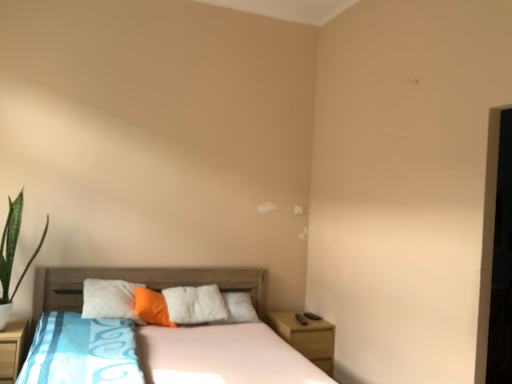
Measure the distance between point (23, 321) and camera.

2.94 meters.

What are the coordinates of `wooden bed at center` in the screenshot? It's located at pyautogui.click(x=190, y=327).

Consider the image. Is wooden nightstand at lower right, acting as the first nightstand starting from the back, oriented away from wooden bed at center?

No, wooden nightstand at lower right, acting as the first nightstand starting from the back,'s orientation is not away from wooden bed at center.

Does wooden nightstand at lower right, acting as the first nightstand starting from the back, have a larger size compared to wooden bed at center?

No.

Does wooden nightstand at lower right, the second nightstand positioned from the front, appear on the right side of wooden bed at center?

Correct, you'll find wooden nightstand at lower right, the second nightstand positioned from the front, to the right of wooden bed at center.

Does wooden nightstand at lower right, acting as the first nightstand starting from the back, have a lesser width compared to wooden bed at center?

Yes.

Does wooden nightstand at lower left, the 1th nightstand viewed from the front, come in front of green leafy plant at left?

No.

From the image's perspective, which object appears higher, wooden nightstand at lower left, the 2th nightstand in the back-to-front sequence, or green leafy plant at left?

From the image's view, green leafy plant at left is above.

Consider the image. Which is behind, wooden bed at center or wooden nightstand at lower left, the 1th nightstand viewed from the front?

wooden nightstand at lower left, the 1th nightstand viewed from the front, is behind.

Is point (188, 284) positioned behind point (26, 343)?

Yes, it is.

Considering the relative sizes of wooden bed at center and wooden nightstand at lower left, the 1th nightstand viewed from the front, in the image provided, is wooden bed at center shorter than wooden nightstand at lower left, the 1th nightstand viewed from the front,?

No.

Looking at this image, is the surface of wooden bed at center in direct contact with wooden nightstand at lower left, the 1th nightstand viewed from the front?

wooden bed at center and wooden nightstand at lower left, the 1th nightstand viewed from the front, are not in contact.

Considering the positions of objects wooden nightstand at lower right, acting as the first nightstand starting from the back, and wooden nightstand at lower left, which is the 2th nightstand from right to left, in the image provided, who is more to the left, wooden nightstand at lower right, acting as the first nightstand starting from the back, or wooden nightstand at lower left, which is the 2th nightstand from right to left,?

From the viewer's perspective, wooden nightstand at lower left, which is the 2th nightstand from right to left, appears more on the left side.

Does wooden nightstand at lower right, marked as the first nightstand in a right-to-left arrangement, have a lesser height compared to wooden nightstand at lower left, the 1th nightstand viewed from the front?

Result: Yes, wooden nightstand at lower right, marked as the first nightstand in a right-to-left arrangement, is shorter than wooden nightstand at lower left, the 1th nightstand viewed from the front.

Is wooden nightstand at lower right, marked as the first nightstand in a right-to-left arrangement, wider than wooden nightstand at lower left, the 2th nightstand in the back-to-front sequence?

No, wooden nightstand at lower right, marked as the first nightstand in a right-to-left arrangement, is not wider than wooden nightstand at lower left, the 2th nightstand in the back-to-front sequence.

Which is closer to the camera, (x=5, y=301) or (x=326, y=338)?

Point (x=5, y=301) is positioned closer to the camera compared to point (x=326, y=338).

Looking at this image, can you confirm if green leafy plant at left is wider than wooden nightstand at lower right, marked as the first nightstand in a right-to-left arrangement?

Yes.

In order to click on plant that is on the left side of wooden nightstand at lower right, which is the 2th nightstand from left to right in this screenshot , I will do `click(13, 247)`.

Is wooden nightstand at lower left, which is the 2th nightstand from right to left, turned away from wooden bed at center?

No, wooden nightstand at lower left, which is the 2th nightstand from right to left, is not facing the opposite direction of wooden bed at center.

From the image's perspective, is wooden nightstand at lower left, the 1th nightstand viewed from the front, above or below wooden bed at center?

wooden nightstand at lower left, the 1th nightstand viewed from the front, is situated lower than wooden bed at center in the image.

From a real-world perspective, does wooden nightstand at lower left, the 2th nightstand in the back-to-front sequence, stand above wooden bed at center?

No.

From a real-world perspective, is wooden bed at center positioned over orange soft pillow at center based on gravity?

No, from a real-world perspective, wooden bed at center is not over orange soft pillow at center

Is wooden bed at center facing towards orange soft pillow at center?

No, wooden bed at center does not turn towards orange soft pillow at center.

Can you confirm if wooden bed at center is shorter than orange soft pillow at center?

No.

Identify the location of bed that appears on the left of wooden nightstand at lower right, the second nightstand positioned from the front. This screenshot has height=384, width=512. (190, 327).

This screenshot has height=384, width=512. I want to click on the 1st nightstand directly beneath the green leafy plant at left (from a real-world perspective), so click(x=13, y=348).

Based on their spatial positions, is wooden nightstand at lower right, acting as the first nightstand starting from the back, or wooden nightstand at lower left, which is the 2th nightstand from right to left, further from green leafy plant at left?

wooden nightstand at lower right, acting as the first nightstand starting from the back, lies further to green leafy plant at left than the other object.

Which object lies further to the anchor point wooden nightstand at lower left, which is the 2th nightstand from right to left, wooden nightstand at lower right, marked as the first nightstand in a right-to-left arrangement, or orange soft pillow at center?

Among the two, wooden nightstand at lower right, marked as the first nightstand in a right-to-left arrangement, is located further to wooden nightstand at lower left, which is the 2th nightstand from right to left.

From the image, which object appears to be farther from wooden bed at center, green leafy plant at left or orange soft pillow at center?

green leafy plant at left is positioned further to the anchor wooden bed at center.

Based on their spatial positions, is wooden nightstand at lower left, the 1th nightstand viewed from the front, or wooden nightstand at lower right, which is the 2th nightstand from left to right, further from wooden bed at center?

The object further to wooden bed at center is wooden nightstand at lower left, the 1th nightstand viewed from the front.

From the image, which object appears to be nearer to wooden nightstand at lower right, the second nightstand positioned from the front, wooden nightstand at lower left, the first nightstand positioned from the left, or wooden bed at center?

wooden bed at center is closer to wooden nightstand at lower right, the second nightstand positioned from the front.

When comparing their distances from green leafy plant at left, does wooden nightstand at lower left, the 1th nightstand viewed from the front, or wooden nightstand at lower right, which is the 2th nightstand from left to right, seem further?

Based on the image, wooden nightstand at lower right, which is the 2th nightstand from left to right, appears to be further to green leafy plant at left.

Which object lies further to the anchor point green leafy plant at left, wooden nightstand at lower right, marked as the first nightstand in a right-to-left arrangement, or wooden bed at center?

The object further to green leafy plant at left is wooden nightstand at lower right, marked as the first nightstand in a right-to-left arrangement.

Looking at the image, which one is located closer to orange soft pillow at center, wooden nightstand at lower left, the 1th nightstand viewed from the front, or wooden nightstand at lower right, which is the 2th nightstand from left to right?

wooden nightstand at lower left, the 1th nightstand viewed from the front, is positioned closer to the anchor orange soft pillow at center.

Locate an element on the screen. The image size is (512, 384). plant located between wooden bed at center and wooden nightstand at lower left, which is the 2th nightstand from right to left, in the depth direction is located at coordinates (13, 247).

The image size is (512, 384). I want to click on plant between wooden bed at center and orange soft pillow at center along the z-axis, so click(13, 247).

Identify the location of pillow situated between wooden nightstand at lower left, the first nightstand positioned from the left, and wooden nightstand at lower right, which is the 2th nightstand from left to right, from left to right. (152, 307).

Locate an element on the screen. pillow between wooden bed at center and wooden nightstand at lower right, the second nightstand positioned from the front, along the z-axis is located at coordinates (152, 307).